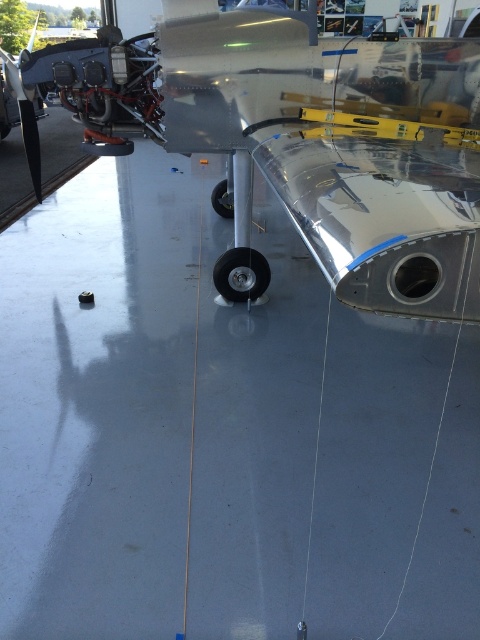
Question: Which object is farther from the camera taking this photo?

Choices:
 (A) metallic silver airplane at center
 (B) brushed metal propeller at left

Answer: (B)

Question: Which point appears closest to the camera in this image?

Choices:
 (A) (26, 141)
 (B) (131, 147)

Answer: (A)

Question: Does metallic silver airplane at center lie in front of brushed metal propeller at left?

Choices:
 (A) no
 (B) yes

Answer: (B)

Question: Can you confirm if metallic silver airplane at center is positioned to the left of brushed metal propeller at left?

Choices:
 (A) no
 (B) yes

Answer: (A)

Question: From the image, what is the correct spatial relationship of metallic silver airplane at center in relation to brushed metal propeller at left?

Choices:
 (A) left
 (B) right

Answer: (B)